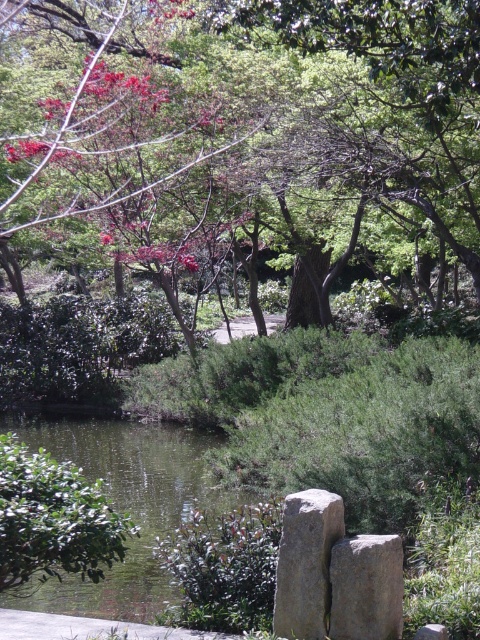
Question: Can you confirm if green leafy tree at upper center is positioned below gray rough stone at center?

Choices:
 (A) no
 (B) yes

Answer: (A)

Question: Estimate the real-world distances between objects in this image. Which object is farther from the green liquid water at center?

Choices:
 (A) smooth gray stone at center
 (B) green leafy tree at upper center
 (C) gray rough stone at center

Answer: (B)

Question: Which of these objects is positioned farthest from the green leafy tree at upper center?

Choices:
 (A) green liquid water at center
 (B) smooth gray stone at center
 (C) gray stone at center

Answer: (B)

Question: Is green liquid water at center behind smooth gray stone at center?

Choices:
 (A) yes
 (B) no

Answer: (A)

Question: Where is green leafy tree at upper center located in relation to green liquid water at center in the image?

Choices:
 (A) right
 (B) left

Answer: (A)

Question: Among these objects, which one is nearest to the camera?

Choices:
 (A) green leafy tree at upper center
 (B) gray stone at center

Answer: (B)